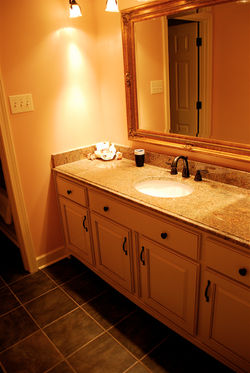
In order to click on mirror in this screenshot , I will do `click(223, 87)`.